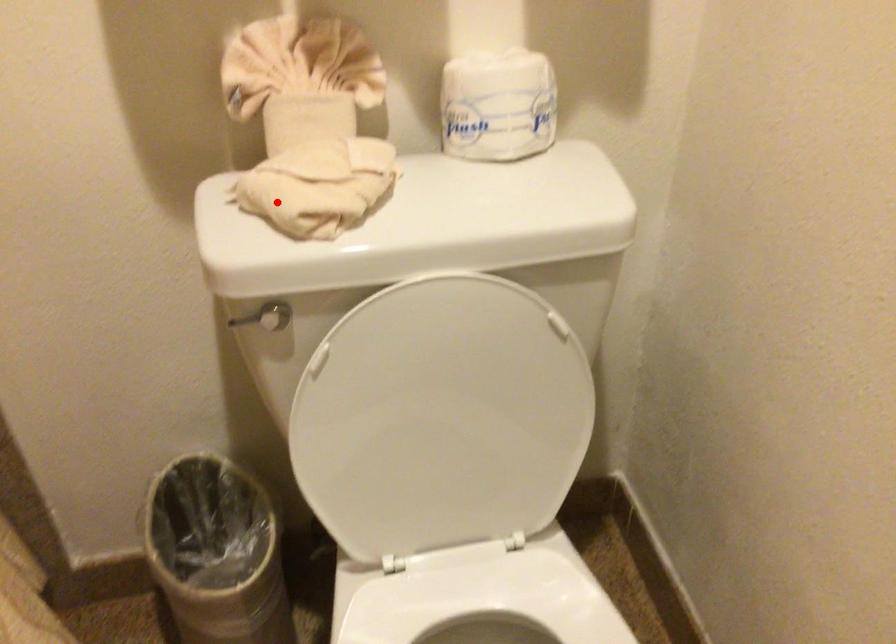
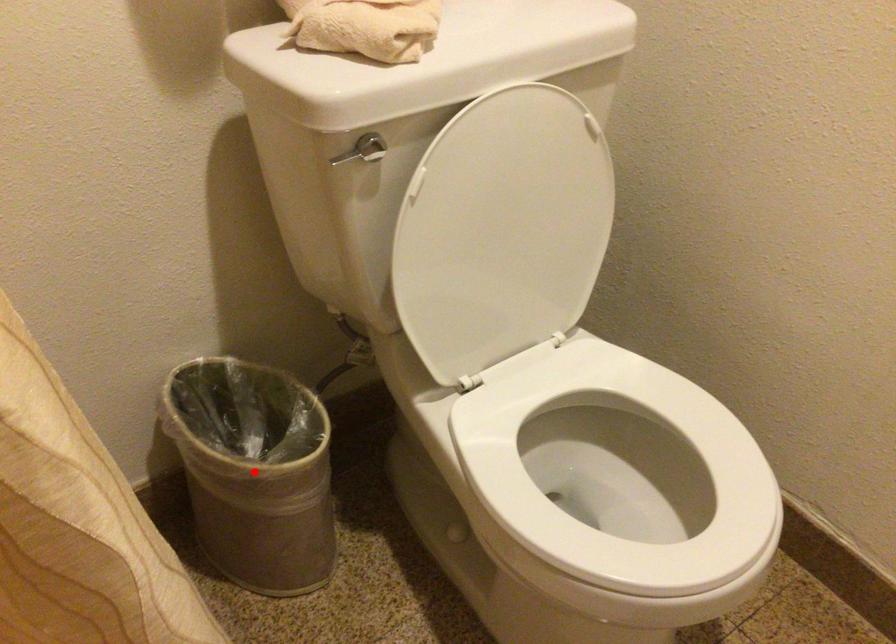
I am providing you with two images of the same scene from different viewpoints. A red point is marked on the first image and another point is marked on the second image. Are the points marked in image1 and image2 representing the same 3D position?

No